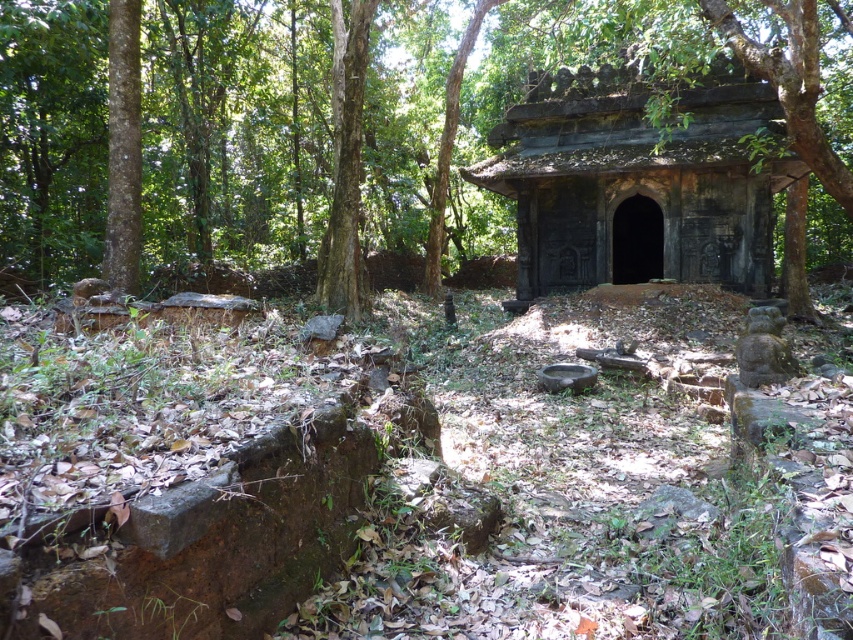
You are an explorer standing in front of the dark gray stone hut at center and the brown rough tree at center. You need to determine which one is wider. Which object has a greater width?

The brown rough tree at center has a greater width than the dark gray stone hut at center.

You are an archaeologist exploring the ancient stone structure. You notice a brown rough tree at center and a dark gray stone hut at center. Based on their positions, which object is located to the left side of the other?

The brown rough tree at center is to the left of the dark gray stone hut at center.

You are standing at the entrance of the ancient stone structure and notice a point marked at coordinates (234, 129). What object is located at that point?

The brown rough tree at center is located at point (234, 129).